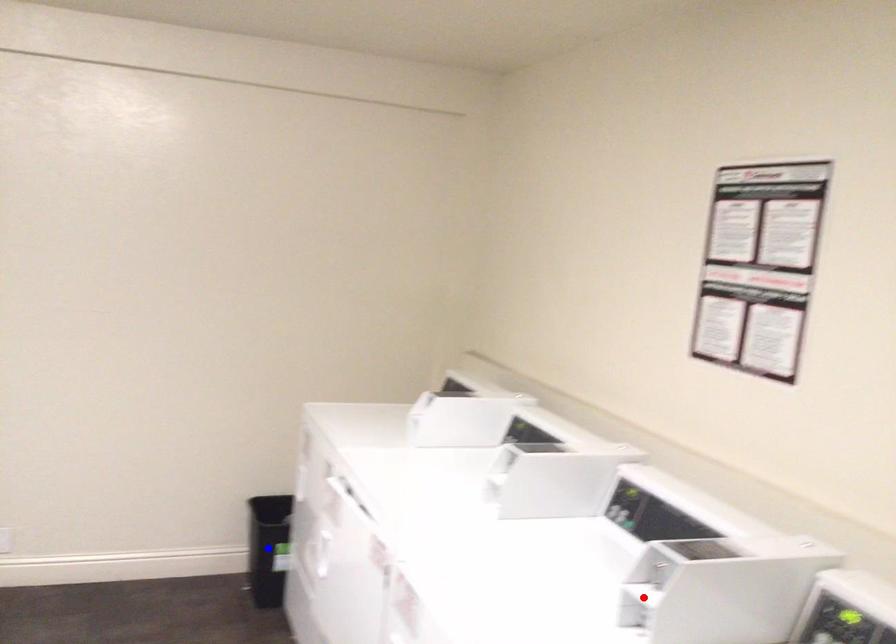
Question: Two points are marked on the image. Which point is closer to the camera?

Choices:
 (A) Blue point is closer.
 (B) Red point is closer.

Answer: (B)